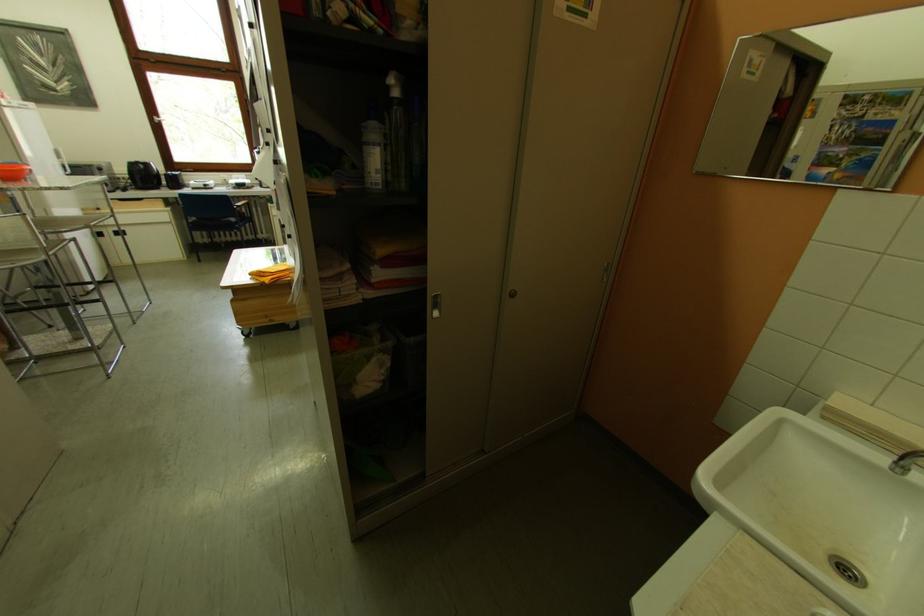
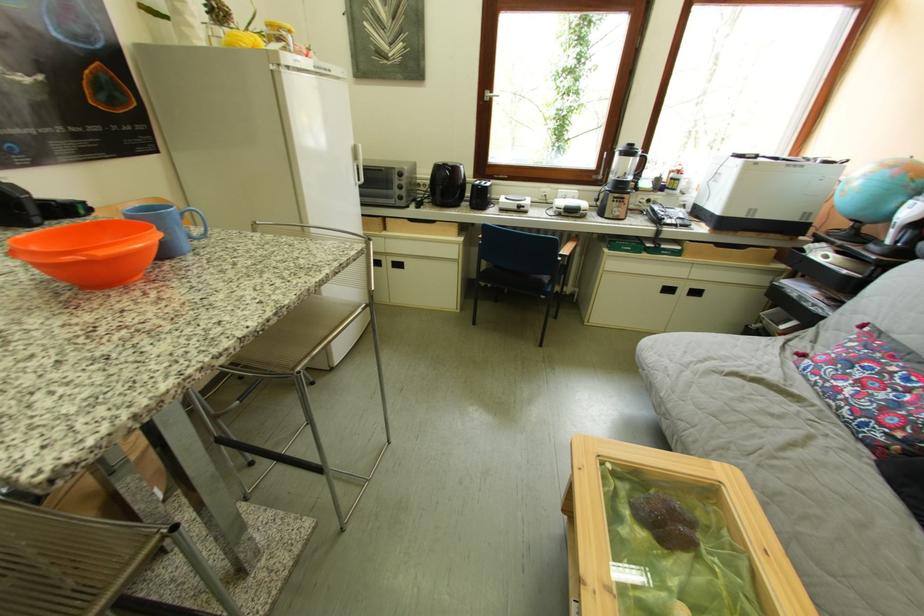
Where in the second image is the point corresponding to the point at 146,168 from the first image?

(451, 171)